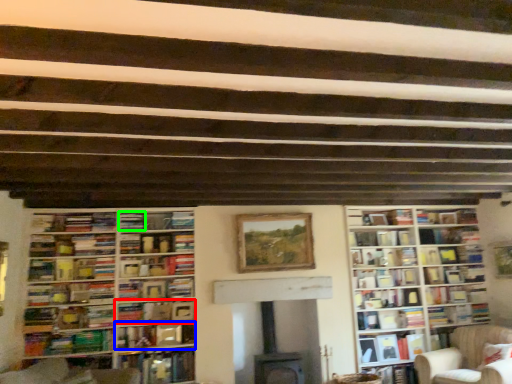
Question: Which object is the closest to the book (highlighted by a red box)? Choose among these: book (highlighted by a blue box) or book (highlighted by a green box).

Choices:
 (A) book
 (B) book

Answer: (A)